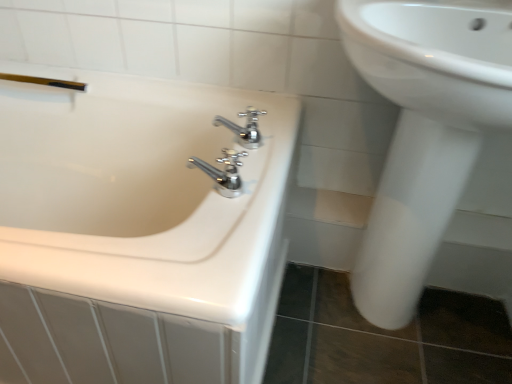
You are a GUI agent. You are given a task and a screenshot of the screen. Output one action in this format:
    pyautogui.click(x=<x>, y=<y>)
    Task: Click on the free space in front of chrome metallic faucet at center, the first tap when ordered from front to back
    This screenshot has height=384, width=512.
    Given the screenshot: What is the action you would take?
    pyautogui.click(x=196, y=245)